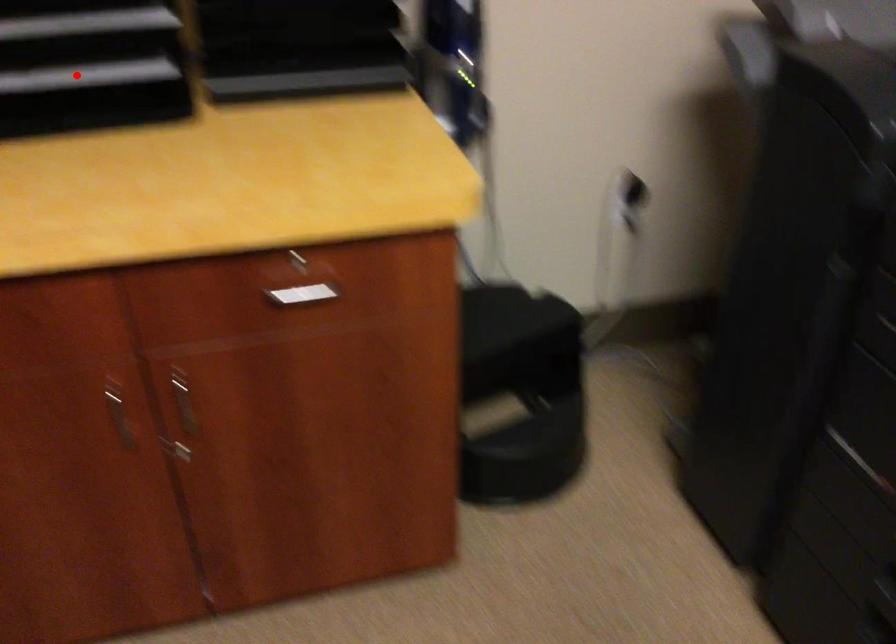
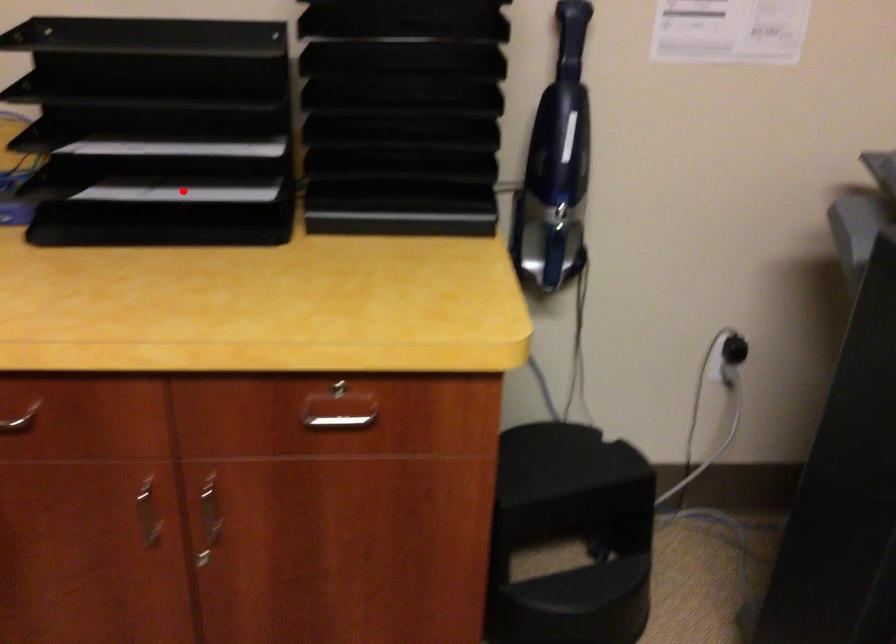
I am providing you with two images of the same scene from different viewpoints. A red point is marked on the first image and another point is marked on the second image. Is the red point in image1 aligned with the point shown in image2?

Yes